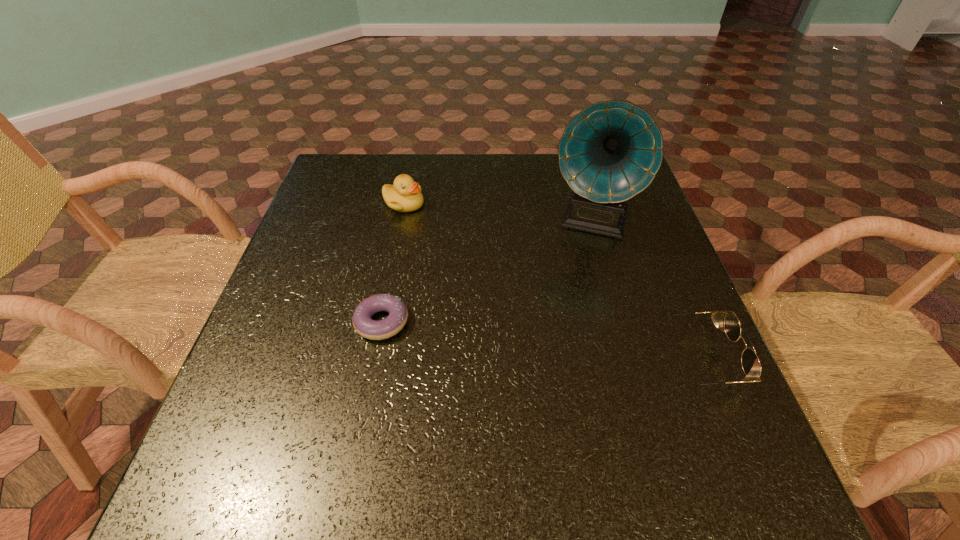
The image size is (960, 540). Find the location of `vacant space on the desktop that is between the shortest object and the sunglasses and is positioned on the beak of the duckling`. vacant space on the desktop that is between the shortest object and the sunglasses and is positioned on the beak of the duckling is located at coordinates (535, 340).

At what (x,y) coordinates should I click in order to perform the action: click on vacant spot on the desktop that is between the shortest object and the sunglasses and is positioned from the horn of the phonograph_record. Please return your answer as a coordinate pair (x, y). The width and height of the screenshot is (960, 540). Looking at the image, I should click on (558, 343).